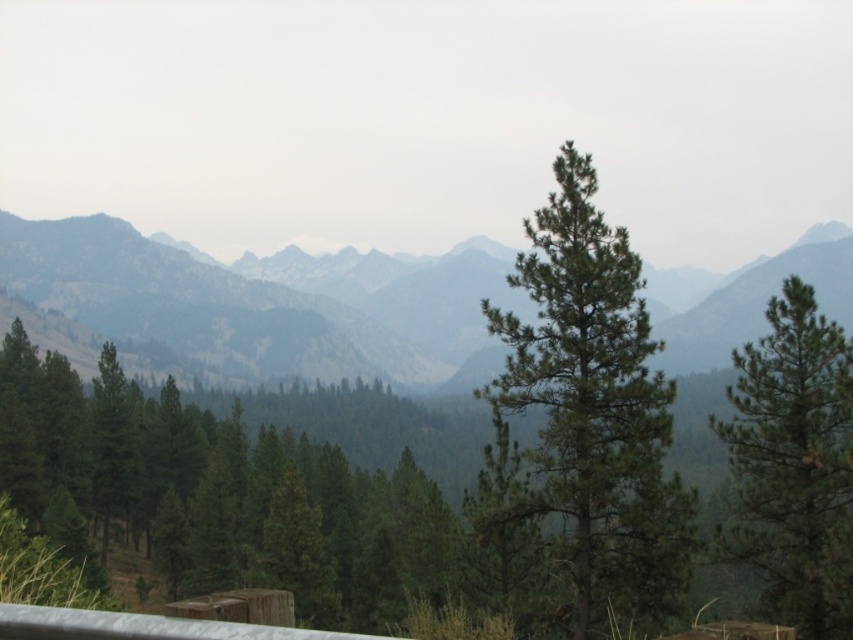
Does green needle-like tree at center have a larger size compared to green needle-like tree at right?

Incorrect, green needle-like tree at center is not larger than green needle-like tree at right.

Describe the element at coordinates (592, 406) in the screenshot. I see `green needle-like tree at center` at that location.

The height and width of the screenshot is (640, 853). What are the coordinates of `green needle-like tree at center` in the screenshot? It's located at (592, 406).

Does green needle-like tree at center appear on the left side of silver metallic rail at lower left?

In fact, green needle-like tree at center is to the right of silver metallic rail at lower left.

Is green needle-like tree at center further to the viewer compared to silver metallic rail at lower left?

Yes, it is behind silver metallic rail at lower left.

The width and height of the screenshot is (853, 640). I want to click on green needle-like tree at center, so click(x=592, y=406).

Does green needle-like tree at right have a greater width compared to silver metallic rail at lower left?

Yes, green needle-like tree at right is wider than silver metallic rail at lower left.

Who is positioned more to the right, green needle-like tree at right or silver metallic rail at lower left?

green needle-like tree at right

Is point (769, 380) positioned behind point (239, 632)?

Yes, point (769, 380) is farther from viewer.

Locate an element on the screen. green needle-like tree at right is located at coordinates (793, 465).